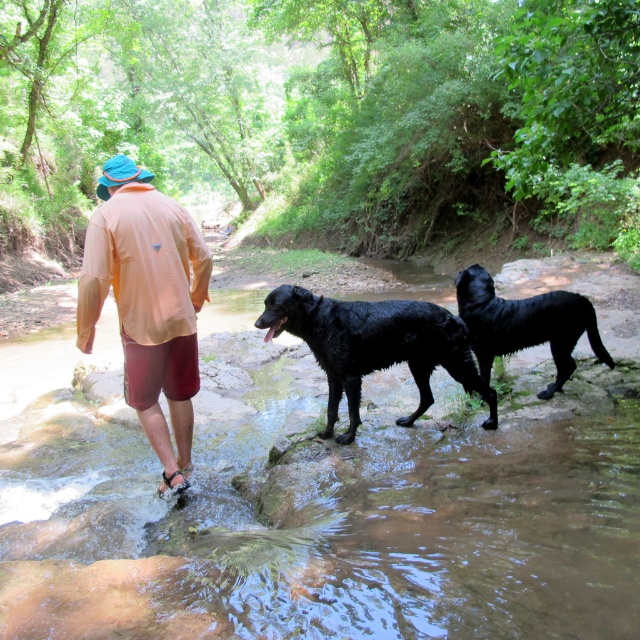
You are a photographer standing at the edge of the stream. You want to take a photo of the orange fabric shirt at center and the shiny black dog at center. If your camera has a maximum focus range of 10 feet, will you be able to capture both subjects clearly in the same frame?

The distance between the orange fabric shirt at center and the shiny black dog at center is 10.24 feet. Since the camera can only focus up to 10 feet, the subjects are slightly out of range. You might need to move closer or use a different camera setting to ensure both are in focus.

You are standing at the edge of the stream and see the orange fabric shirt at center and the clear water at stream center. Which object is closer to your right side?

The clear water at stream center is to the right of orange fabric shirt at center, so the clear water at stream center is closer to your right side.

You are standing at the point marked as point (314, 502) in the image. Based on the scene description, what is the surface you are currently standing on?

The surface at point (314, 502) is clear water at stream center, so you are standing on water.